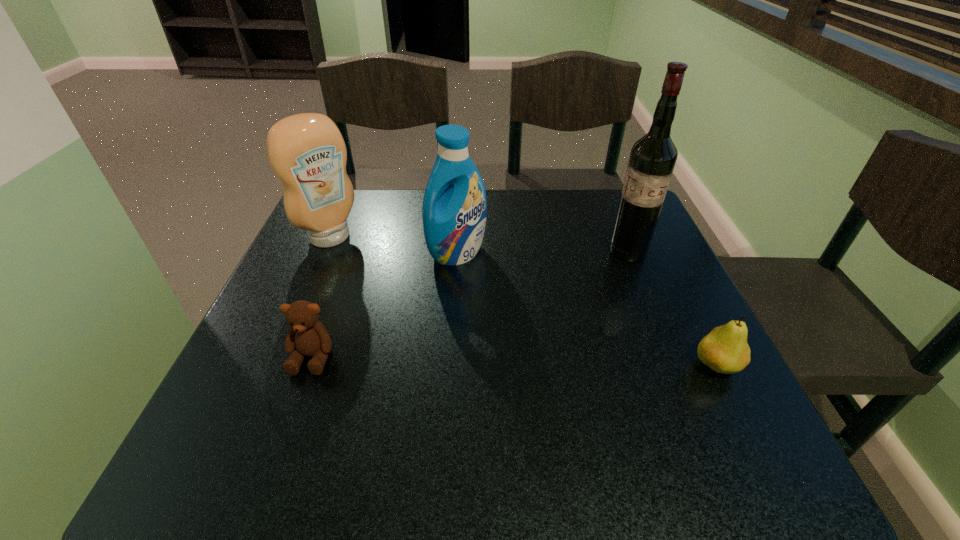
The image size is (960, 540). I want to click on vacant area that lies between the teddy bear and the condiment, so click(322, 297).

In order to click on vacant area that lies between the tallest object and the third object from left to right in this screenshot , I will do `click(542, 252)`.

The height and width of the screenshot is (540, 960). I want to click on vacant space in between the condiment and the pear, so click(523, 301).

Find the location of a particular element. free space that is in between the pear and the teddy bear is located at coordinates click(515, 361).

Where is `vacant point located between the pear and the teddy bear`? Image resolution: width=960 pixels, height=540 pixels. vacant point located between the pear and the teddy bear is located at coordinates (515, 361).

Find the location of a particular element. vacant space in between the pear and the condiment is located at coordinates (523, 301).

Find the location of a particular element. unoccupied position between the third object from left to right and the tallest object is located at coordinates (542, 252).

Where is `vacant region between the pear and the teddy bear`? This screenshot has width=960, height=540. vacant region between the pear and the teddy bear is located at coordinates click(x=515, y=361).

This screenshot has height=540, width=960. I want to click on free point between the pear and the teddy bear, so point(515,361).

Identify which object is the fourth nearest to the teddy bear. Please provide its 2D coordinates. Your answer should be formatted as a tuple, i.e. [(x, y)], where the tuple contains the x and y coordinates of a point satisfying the conditions above.

[(725, 350)]